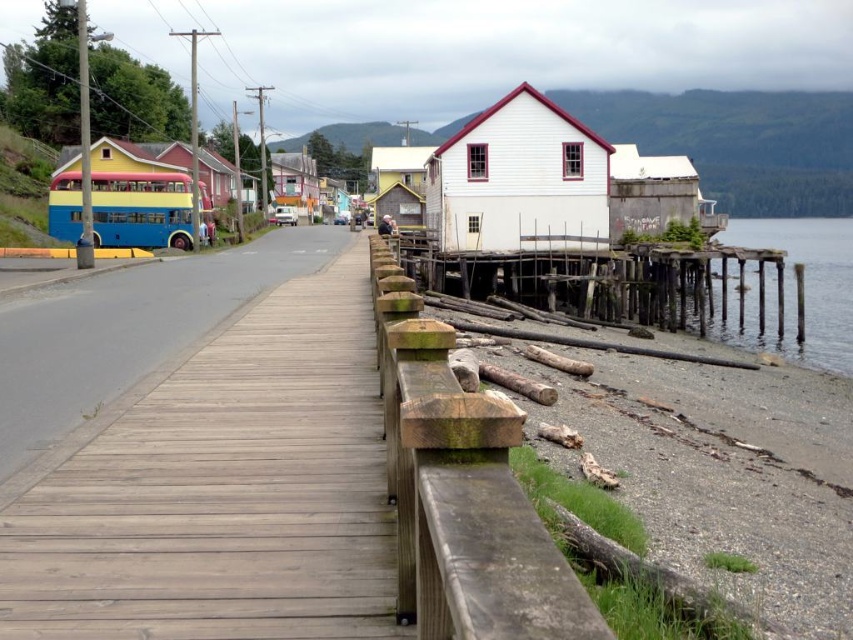
You are a tourist standing on the boardwalk and want to take a photo of the white wood house at center and the transparent wooden pier at lower right. Which object should you focus on first if you want to capture both in the same frame without moving your camera?

The white wood house at center is shorter than the transparent wooden pier at lower right. To capture both in the same frame, focus on the transparent wooden pier at lower right first since it is taller and will require adjusting the camera angle to include the shorter house.